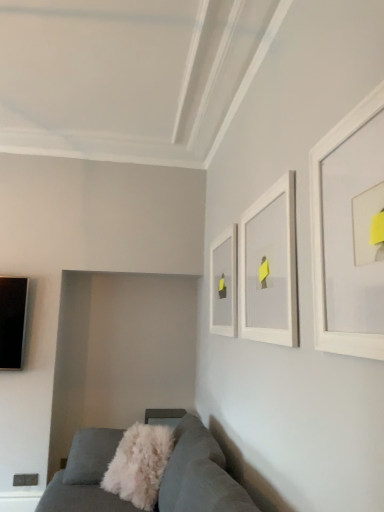
Question: Based on their sizes in the image, would you say white fluffy throw pillow at lower center is bigger or smaller than white matte picture frame at upper center, which is the 1th picture frame from back to front?

Choices:
 (A) big
 (B) small

Answer: (A)

Question: Does point (163, 440) appear closer or farther from the camera than point (213, 257)?

Choices:
 (A) closer
 (B) farther

Answer: (A)

Question: Which of these objects is positioned farthest from the white fluffy throw pillow at lower center?

Choices:
 (A) white matte picture frame at upper right, acting as the first picture frame starting from the front
 (B) white matte picture frame at upper center, the second picture frame when ordered from right to left
 (C) white matte picture frame at upper center, which is the 1th picture frame from back to front
 (D) velvet grey couch at lower left

Answer: (A)

Question: Considering the real-world distances, which object is farthest from the white matte picture frame at upper right, the third picture frame from the left?

Choices:
 (A) velvet grey couch at lower left
 (B) white fluffy throw pillow at lower center
 (C) white matte picture frame at upper center, positioned as the second picture frame in back-to-front order
 (D) white matte picture frame at upper center, which is the 1th picture frame from back to front

Answer: (B)